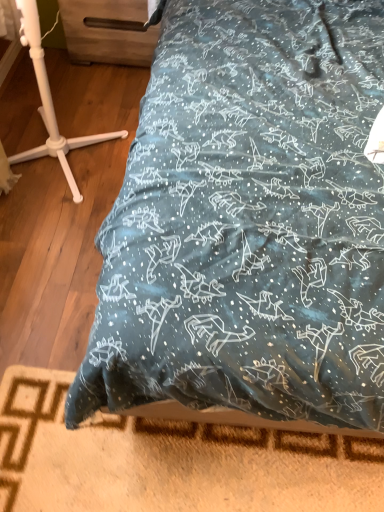
Question: Is white plastic tripod at left positioned in front of wooden drawer at upper left?

Choices:
 (A) yes
 (B) no

Answer: (A)

Question: Is white plastic tripod at left positioned with its back to wooden drawer at upper left?

Choices:
 (A) yes
 (B) no

Answer: (B)

Question: Does white plastic tripod at left appear on the right side of wooden drawer at upper left?

Choices:
 (A) no
 (B) yes

Answer: (A)

Question: From the image's perspective, is white plastic tripod at left beneath wooden drawer at upper left?

Choices:
 (A) yes
 (B) no

Answer: (A)

Question: Can you confirm if white plastic tripod at left is shorter than wooden drawer at upper left?

Choices:
 (A) no
 (B) yes

Answer: (A)

Question: From their relative heights in the image, would you say white plastic tripod at left is taller or shorter than wooden drawer at upper left?

Choices:
 (A) short
 (B) tall

Answer: (B)

Question: Is white plastic tripod at left inside the boundaries of wooden drawer at upper left, or outside?

Choices:
 (A) inside
 (B) outside

Answer: (B)

Question: From a real-world perspective, is white plastic tripod at left positioned above or below wooden drawer at upper left?

Choices:
 (A) above
 (B) below

Answer: (A)

Question: Is white plastic tripod at left to the left or to the right of wooden drawer at upper left in the image?

Choices:
 (A) right
 (B) left

Answer: (B)

Question: Looking at the image, does wooden bed frame at lower center seem bigger or smaller compared to white plastic tripod at left?

Choices:
 (A) small
 (B) big

Answer: (A)

Question: Is point (44, 458) positioned closer to the camera than point (33, 158)?

Choices:
 (A) closer
 (B) farther

Answer: (A)

Question: From the image's perspective, relative to white plastic tripod at left, is wooden bed frame at lower center above or below?

Choices:
 (A) below
 (B) above

Answer: (A)

Question: Choose the correct answer: Is wooden bed frame at lower center inside white plastic tripod at left or outside it?

Choices:
 (A) inside
 (B) outside

Answer: (B)

Question: Is wooden drawer at upper left wider or thinner than white plastic tripod at left?

Choices:
 (A) thin
 (B) wide

Answer: (B)

Question: Would you say wooden drawer at upper left is inside or outside white plastic tripod at left?

Choices:
 (A) inside
 (B) outside

Answer: (B)